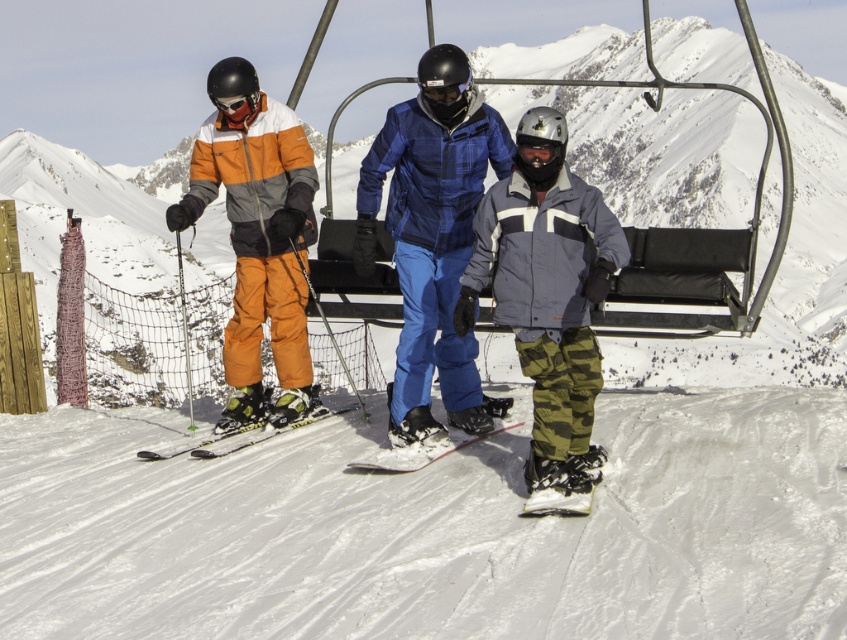
You are a photographer positioned at the origin point of the coordinate system. You want to take a photo of the camouflage snow pants at center. What are the coordinates where you should aim your camera?

The coordinates to aim the camera are at point (547,300).